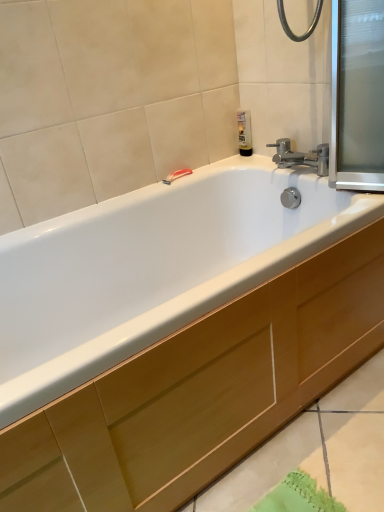
This screenshot has height=512, width=384. I want to click on wooden cabinet at lower center, so click(x=191, y=402).

Measure the distance between point (251, 143) and camera.

Point (251, 143) and camera are 1.72 meters apart.

What is the approximate width of transparent glass screen door at upper right?

6.34 inches.

Describe the element at coordinates (357, 95) in the screenshot. I see `transparent glass screen door at upper right` at that location.

Identify the location of red plastic towel bar at upper center. (177, 175).

Is the position of red plastic towel bar at upper center more distant than that of translucent plastic soap dispenser at upper right?

No, it is not.

Considering the relative sizes of red plastic towel bar at upper center and translucent plastic soap dispenser at upper right in the image provided, is red plastic towel bar at upper center wider than translucent plastic soap dispenser at upper right?

No.

Which is nearer, (x=181, y=169) or (x=243, y=134)?

The point (x=181, y=169) is closer.

From their relative heights in the image, would you say red plastic towel bar at upper center is taller or shorter than translucent plastic soap dispenser at upper right?

red plastic towel bar at upper center is shorter than translucent plastic soap dispenser at upper right.

From a real-world perspective, between red plastic towel bar at upper center and wooden cabinet at lower center, who is vertically higher?

red plastic towel bar at upper center is physically above.

Is red plastic towel bar at upper center taller than wooden cabinet at lower center?

No, red plastic towel bar at upper center is not taller than wooden cabinet at lower center.

Identify the location of drawer below the red plastic towel bar at upper center (from a real-world perspective). This screenshot has width=384, height=512. (191, 402).

Based on their sizes in the image, would you say translucent plastic soap dispenser at upper right is bigger or smaller than red plastic towel bar at upper center?

translucent plastic soap dispenser at upper right is bigger than red plastic towel bar at upper center.

In terms of height, does translucent plastic soap dispenser at upper right look taller or shorter compared to red plastic towel bar at upper center?

Clearly, translucent plastic soap dispenser at upper right is taller compared to red plastic towel bar at upper center.

Could you tell me if translucent plastic soap dispenser at upper right is turned towards red plastic towel bar at upper center?

No, translucent plastic soap dispenser at upper right is not aimed at red plastic towel bar at upper center.

Considering the relative positions of wooden cabinet at lower center and transparent glass screen door at upper right in the image provided, is wooden cabinet at lower center in front of transparent glass screen door at upper right?

Yes, the depth of wooden cabinet at lower center is less than that of transparent glass screen door at upper right.

From the image's perspective, is wooden cabinet at lower center under transparent glass screen door at upper right?

Correct, wooden cabinet at lower center appears lower than transparent glass screen door at upper right in the image.

Which of these two, wooden cabinet at lower center or transparent glass screen door at upper right, is smaller?

Smaller between the two is transparent glass screen door at upper right.

From a real-world perspective, does wooden cabinet at lower center sit lower than transparent glass screen door at upper right?

Correct, in the physical world, wooden cabinet at lower center is lower than transparent glass screen door at upper right.

Where is `soap dispenser beneath the transparent glass screen door at upper right (from a real-world perspective)`? The height and width of the screenshot is (512, 384). soap dispenser beneath the transparent glass screen door at upper right (from a real-world perspective) is located at coordinates (244, 132).

How many degrees apart are the facing directions of transparent glass screen door at upper right and translucent plastic soap dispenser at upper right?

92.2 degrees.

From a real-world perspective, which object rests below the other?

In real-world perspective, translucent plastic soap dispenser at upper right is lower.

Choose the correct answer: Is transparent glass screen door at upper right inside translucent plastic soap dispenser at upper right or outside it?

transparent glass screen door at upper right is not enclosed by translucent plastic soap dispenser at upper right.

From the image's perspective, would you say transparent glass screen door at upper right is positioned over red plastic towel bar at upper center?

Yes, from the image's perspective, transparent glass screen door at upper right is on top of red plastic towel bar at upper center.

This screenshot has height=512, width=384. Identify the location of screen door above the red plastic towel bar at upper center (from the image's perspective). (357, 95).

Is the surface of transparent glass screen door at upper right in direct contact with red plastic towel bar at upper center?

No, transparent glass screen door at upper right is not next to red plastic towel bar at upper center.

Which of these two, translucent plastic soap dispenser at upper right or wooden cabinet at lower center, is bigger?

Bigger between the two is wooden cabinet at lower center.

From the image's perspective, which one is positioned lower, translucent plastic soap dispenser at upper right or wooden cabinet at lower center?

wooden cabinet at lower center, from the image's perspective.

At what (x,y) coordinates should I click in order to perform the action: click on soap dispenser that is above the wooden cabinet at lower center (from the image's perspective). Please return your answer as a coordinate pair (x, y). The image size is (384, 512). Looking at the image, I should click on (244, 132).

Considering the sizes of objects translucent plastic soap dispenser at upper right and wooden cabinet at lower center in the image provided, who is thinner, translucent plastic soap dispenser at upper right or wooden cabinet at lower center?

translucent plastic soap dispenser at upper right is thinner.

Image resolution: width=384 pixels, height=512 pixels. In order to click on soap dispenser above the red plastic towel bar at upper center (from a real-world perspective) in this screenshot , I will do `click(244, 132)`.

Find the location of a particular element. The height and width of the screenshot is (512, 384). drawer to the right of red plastic towel bar at upper center is located at coordinates (191, 402).

Which object lies nearer to the anchor point translucent plastic soap dispenser at upper right, wooden cabinet at lower center or red plastic towel bar at upper center?

red plastic towel bar at upper center is closer to translucent plastic soap dispenser at upper right.

Based on their spatial positions, is transparent glass screen door at upper right or red plastic towel bar at upper center closer to translucent plastic soap dispenser at upper right?

red plastic towel bar at upper center lies closer to translucent plastic soap dispenser at upper right than the other object.

Based on their spatial positions, is translucent plastic soap dispenser at upper right or transparent glass screen door at upper right further from red plastic towel bar at upper center?

transparent glass screen door at upper right.

Considering their positions, is wooden cabinet at lower center positioned further to transparent glass screen door at upper right than translucent plastic soap dispenser at upper right?

wooden cabinet at lower center is positioned further to the anchor transparent glass screen door at upper right.

Looking at the image, which one is located closer to red plastic towel bar at upper center, transparent glass screen door at upper right or wooden cabinet at lower center?

transparent glass screen door at upper right lies closer to red plastic towel bar at upper center than the other object.

Looking at the image, which one is located closer to red plastic towel bar at upper center, wooden cabinet at lower center or transparent glass screen door at upper right?

Among the two, transparent glass screen door at upper right is located nearer to red plastic towel bar at upper center.

From the image, which object appears to be nearer to translucent plastic soap dispenser at upper right, red plastic towel bar at upper center or transparent glass screen door at upper right?

red plastic towel bar at upper center is closer to translucent plastic soap dispenser at upper right.

Which object lies nearer to the anchor point transparent glass screen door at upper right, red plastic towel bar at upper center or translucent plastic soap dispenser at upper right?

The object closer to transparent glass screen door at upper right is translucent plastic soap dispenser at upper right.

Identify the location of screen door between translucent plastic soap dispenser at upper right and wooden cabinet at lower center vertically. (357, 95).

Locate an element on the screen. This screenshot has width=384, height=512. towel bar between transparent glass screen door at upper right and translucent plastic soap dispenser at upper right from front to back is located at coordinates (177, 175).

The height and width of the screenshot is (512, 384). What are the coordinates of `towel bar between transparent glass screen door at upper right and wooden cabinet at lower center in the up-down direction` in the screenshot? It's located at (177, 175).

The width and height of the screenshot is (384, 512). I want to click on towel bar between wooden cabinet at lower center and translucent plastic soap dispenser at upper right along the z-axis, so click(177, 175).